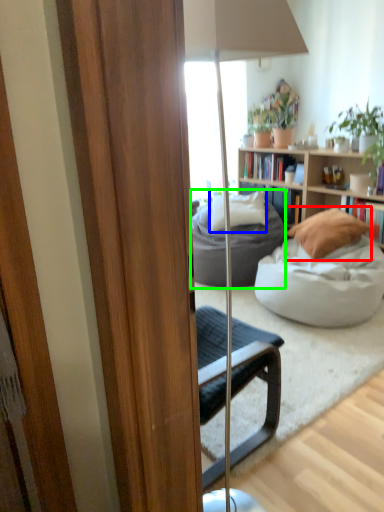
Question: Which is farther away from pillow (highlighted by a red box)? pillow (highlighted by a blue box) or studio couch (highlighted by a green box)?

Choices:
 (A) pillow
 (B) studio couch

Answer: (A)